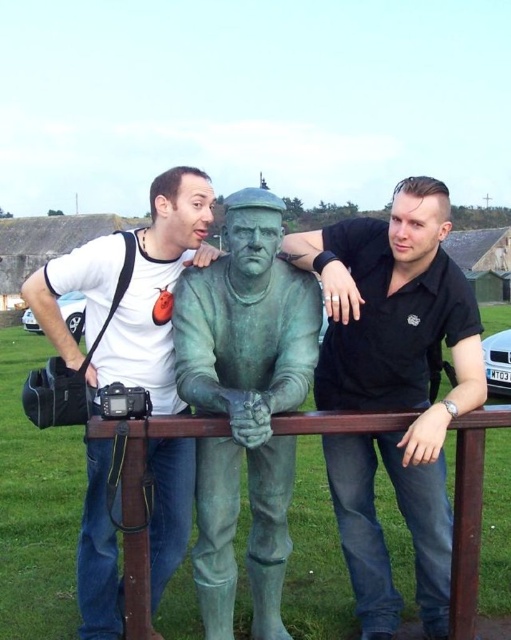
Who is taller, green patina statue at center or white matte t-shirt at upper left?

With more height is white matte t-shirt at upper left.

Is point (239, 228) positioned after point (195, 200)?

No, it is in front of (195, 200).

The image size is (511, 640). What are the coordinates of `green patina statue at center` in the screenshot? It's located at (244, 403).

Image resolution: width=511 pixels, height=640 pixels. I want to click on green patina statue at center, so click(x=244, y=403).

Measure the distance between point (371, 547) and camera.

Point (371, 547) and camera are 9.33 meters apart.

Does black matte shirt at center have a greater height compared to brown wooden rail at center?

Yes, black matte shirt at center is taller than brown wooden rail at center.

Is point (435, 234) positioned after point (458, 477)?

Yes.

Identify the location of black matte shirt at center. (392, 387).

Who is taller, green patina statue at center or brown wooden rail at center?

Standing taller between the two is green patina statue at center.

How much distance is there between green patina statue at center and brown wooden rail at center?

A distance of 8.96 feet exists between green patina statue at center and brown wooden rail at center.

This screenshot has width=511, height=640. Identify the location of green patina statue at center. (244, 403).